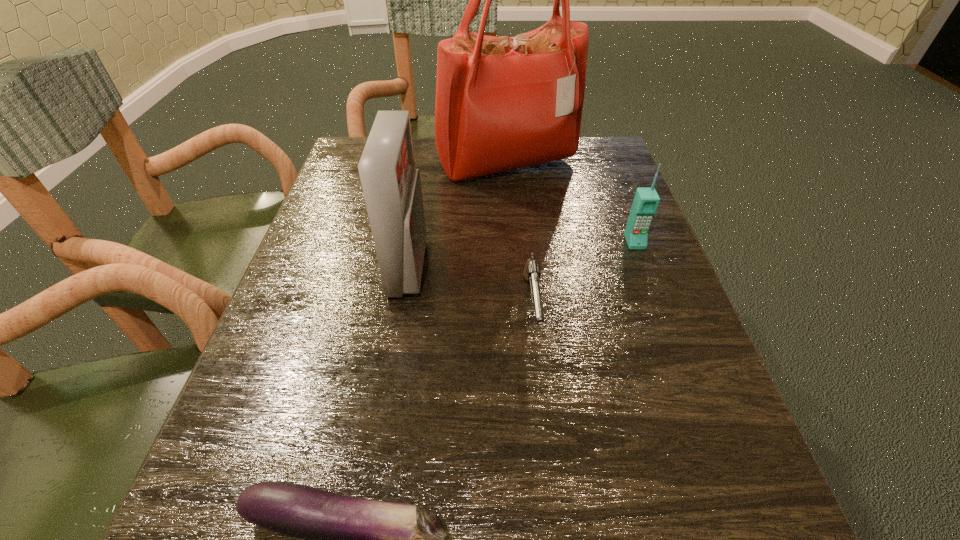
Where is `object present at the far edge`? This screenshot has height=540, width=960. object present at the far edge is located at coordinates (502, 103).

Image resolution: width=960 pixels, height=540 pixels. I want to click on handbag positioned at the right edge, so click(502, 103).

Find the location of a particular element. This screenshot has height=540, width=960. cellular telephone at the right edge is located at coordinates (646, 200).

You are a GUI agent. You are given a task and a screenshot of the screen. Output one action in this format:
    pyautogui.click(x=<x>, y=<y>)
    Task: Click on the object situated at the far right corner
    The width and height of the screenshot is (960, 540).
    Given the screenshot: What is the action you would take?
    pyautogui.click(x=502, y=103)

Find the location of a particular element. The height and width of the screenshot is (540, 960). vacant space at the far edge of the desktop is located at coordinates (422, 153).

Where is `free space at the near edge of the desktop`? This screenshot has height=540, width=960. free space at the near edge of the desktop is located at coordinates coord(490,495).

The width and height of the screenshot is (960, 540). What are the coordinates of `vacant space at the left edge` in the screenshot? It's located at (324, 302).

Locate an element on the screen. vacant space at the right edge of the desktop is located at coordinates (623, 417).

Locate an element on the screen. free location at the far left corner of the desktop is located at coordinates (345, 167).

Locate an element on the screen. vacant space at the far right corner is located at coordinates (620, 168).